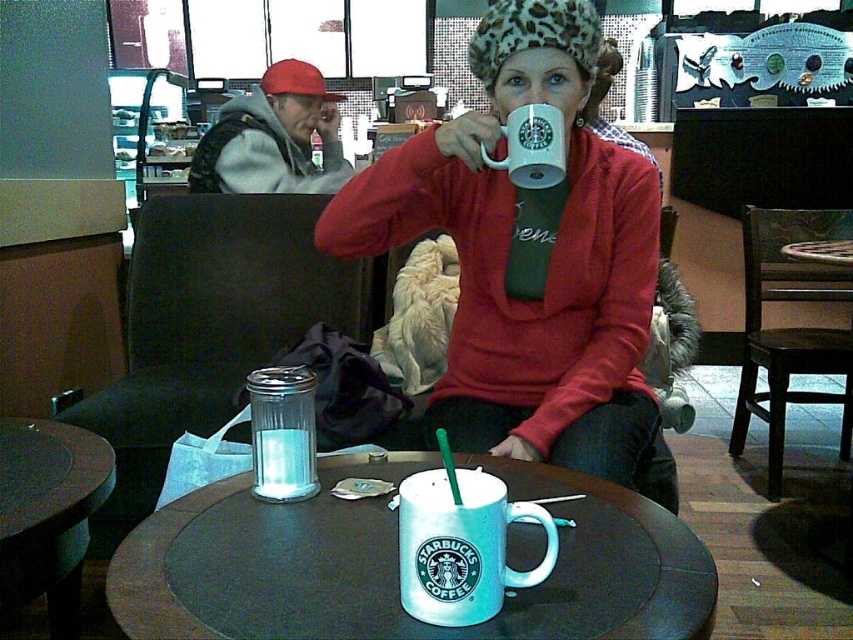
Consider the image. You are a barista at Starbucks and you have two mugs in front of you, the matte white mug at center and the white matte mug at center. A customer wants the taller mug for their hot coffee. Which one should you give them?

The matte white mug at center has a greater height compared to the white matte mug at center, so you should give the customer the matte white mug at center.

You are a barista at the coffee shop and need to place both the matte white mug at center and the white matte mug at center on the round table. According to the image, which mug should be placed first to ensure proper stacking?

The matte white mug at center should be placed first because it is positioned under the white matte mug at center in the image, indicating it is the lower layer in the stack.

You are a barista trying to place a new menu board on the wall behind the frosted glass mug at center. The menu board has dimensions of 12 inches in width and 18 inches in height. Given the coordinates of the mug, can you determine if there is enough space vertically to place the menu board above it without overlapping?

The frosted glass mug at center is located at point (461, 545). Since the menu board is 18 inches tall, and the vertical coordinate of the mug is 0.542, there should be sufficient vertical space above it to place the menu board without overlapping, assuming the wall area above is clear.